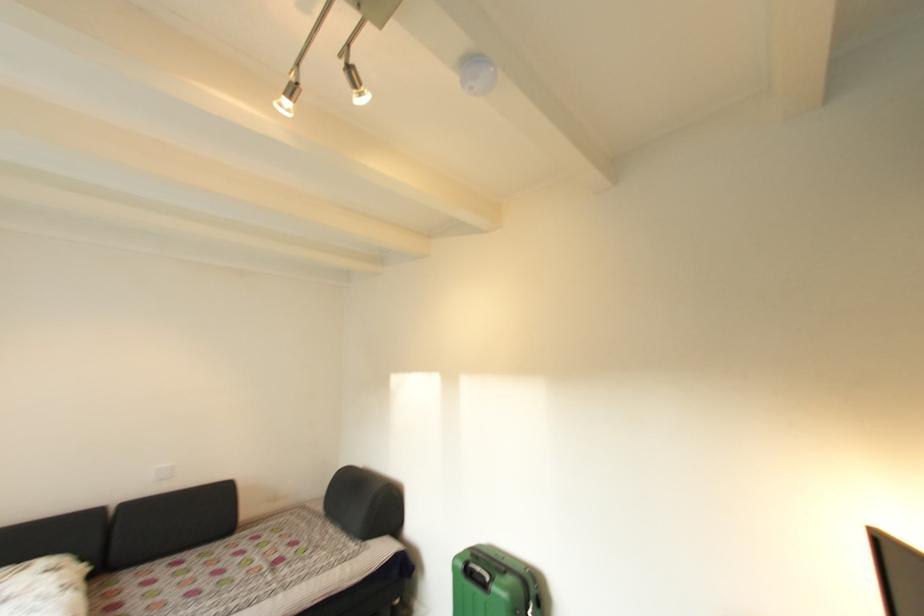
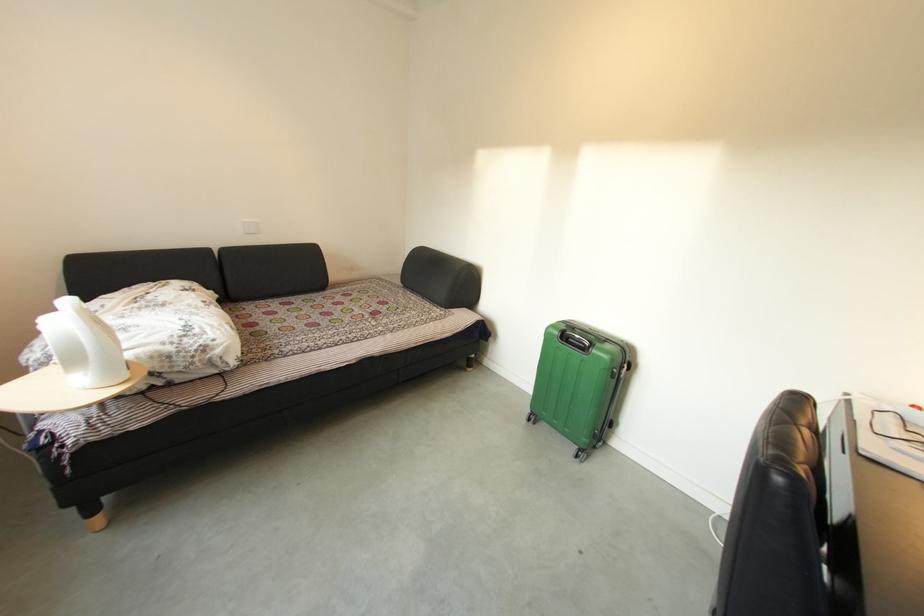
Question: Based on the continuous images, in which direction is the camera rotating? Reply with the corresponding letter.

Choices:
 (A) Left
 (B) Right
 (C) Up
 (D) Down

Answer: (D)